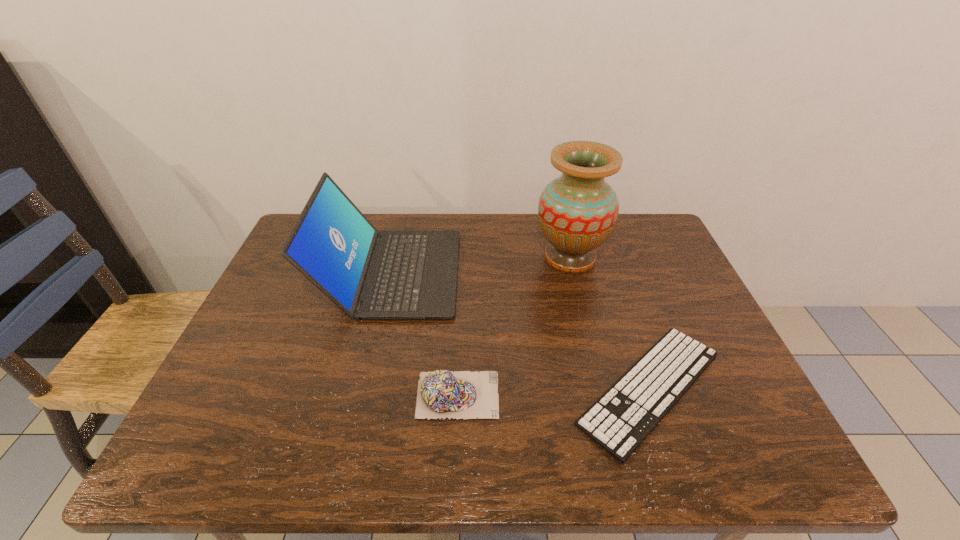
Where is `object that can be found as the third closest to the laptop computer`? Image resolution: width=960 pixels, height=540 pixels. object that can be found as the third closest to the laptop computer is located at coordinates (619, 421).

Identify the location of object that stands as the closest to the vase. (619, 421).

What are the coordinates of `vacant space that satisfies the following two spatial constraints: 1. on the screen of the second tallest object; 2. on the back side of the computer keyboard` in the screenshot? It's located at (363, 388).

Where is `vacant area in the image that satisfies the following two spatial constraints: 1. on the screen of the laptop computer; 2. on the left side of the shortest object`? The image size is (960, 540). vacant area in the image that satisfies the following two spatial constraints: 1. on the screen of the laptop computer; 2. on the left side of the shortest object is located at coordinates (363, 388).

The width and height of the screenshot is (960, 540). What are the coordinates of `vacant space that satisfies the following two spatial constraints: 1. on the screen of the third shortest object; 2. on the right side of the shortest object` in the screenshot? It's located at (363, 388).

Where is `free spot that satisfies the following two spatial constraints: 1. on the front side of the shortest object; 2. on the front, side, and top of the cap`? This screenshot has width=960, height=540. free spot that satisfies the following two spatial constraints: 1. on the front side of the shortest object; 2. on the front, side, and top of the cap is located at coordinates (652, 395).